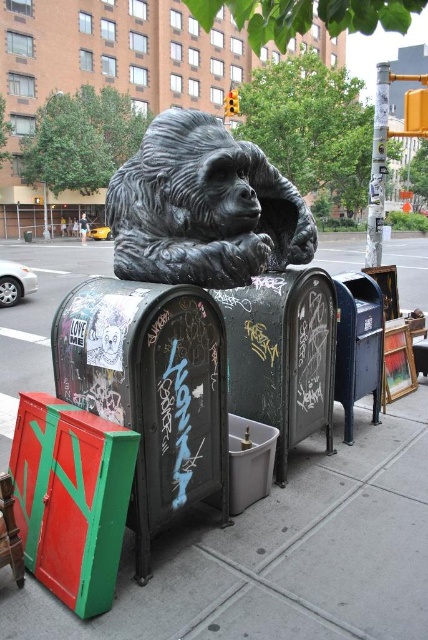
Question: Which is farther from the grungy metal mailbox at center?

Choices:
 (A) metallic blue mailbox at right
 (B) smooth concrete pavement at center

Answer: (B)

Question: Does smooth concrete pavement at center appear on the right side of grungy metal mailbox at center?

Choices:
 (A) no
 (B) yes

Answer: (B)

Question: Does black textured mailbox at center appear under grungy metal mailbox at center?

Choices:
 (A) yes
 (B) no

Answer: (A)

Question: Can you confirm if black textured mailbox at center is bigger than grungy metal mailbox at center?

Choices:
 (A) no
 (B) yes

Answer: (B)

Question: Which point is farther to the camera?

Choices:
 (A) metallic blue mailbox at right
 (B) bronze statue at center
 (C) black textured mailbox at center
 (D) smooth concrete pavement at center

Answer: (A)

Question: Which point is closer to the camera?

Choices:
 (A) bronze statue at center
 (B) metallic blue mailbox at right
 (C) grungy metal mailbox at center
 (D) smooth concrete pavement at center

Answer: (D)